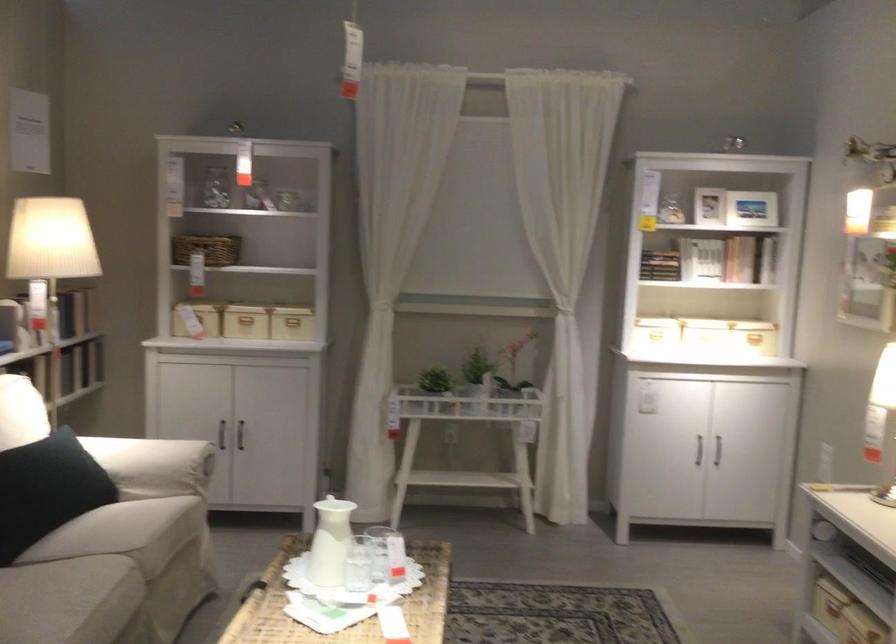
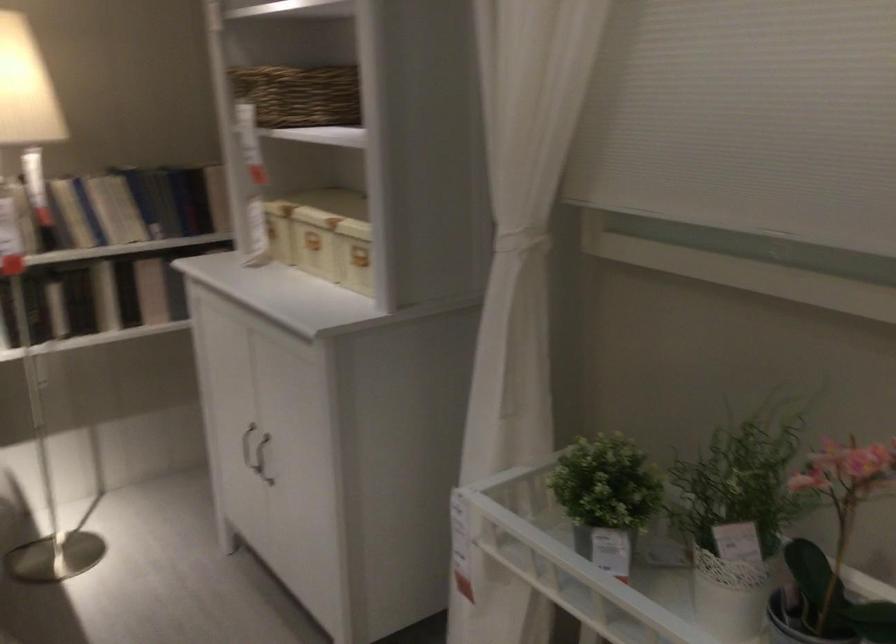
Question: I am providing you with two images of the same scene from different viewpoints. After the viewpoint changes to image2, which objects are now occluded?

Choices:
 (A) book on shelf
 (B) potted green plant
 (C) white cabinet handle
 (D) none of these

Answer: (D)